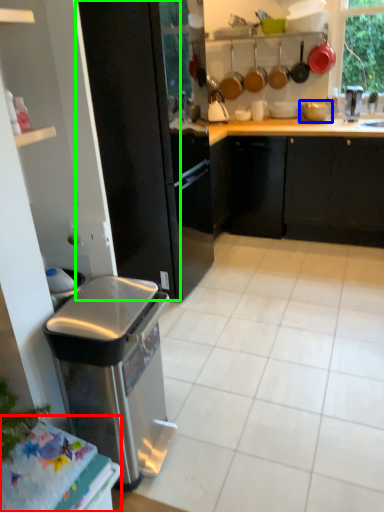
Question: Based on their relative distances, which object is nearer to table (highlighted by a red box)? Choose from appliance (highlighted by a blue box) and screen door (highlighted by a green box).

Choices:
 (A) appliance
 (B) screen door

Answer: (B)